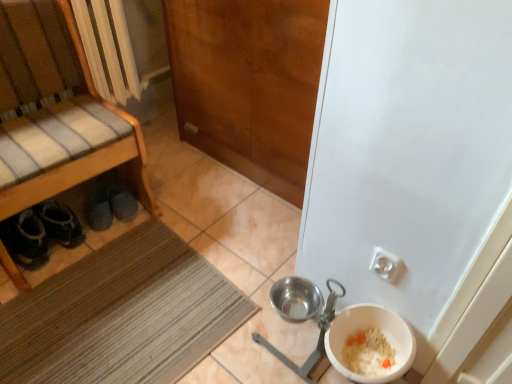
Where is `free spot in front of wooden bench at left`? This screenshot has width=512, height=384. free spot in front of wooden bench at left is located at coordinates (78, 316).